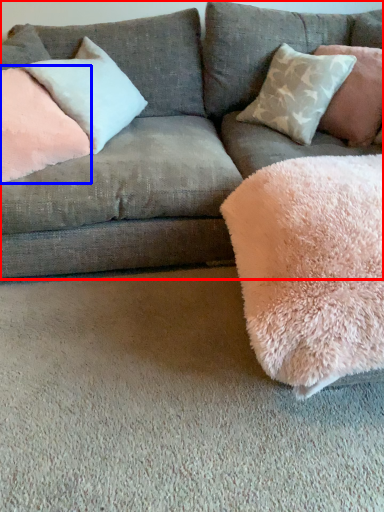
Question: Which object appears farthest to the camera in this image, studio couch (highlighted by a red box) or pillow (highlighted by a blue box)?

Choices:
 (A) studio couch
 (B) pillow

Answer: (B)